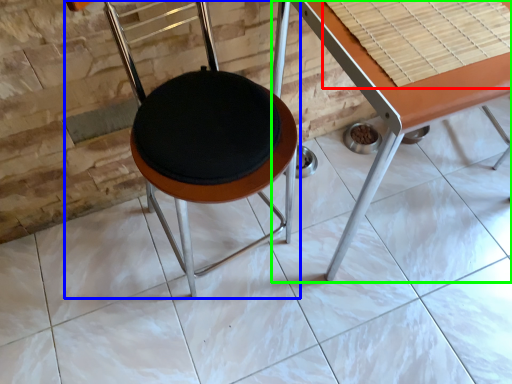
Question: Considering the real-world distances, which object is farthest from table top (highlighted by a red box)? chair (highlighted by a blue box) or table (highlighted by a green box)?

Choices:
 (A) chair
 (B) table

Answer: (A)